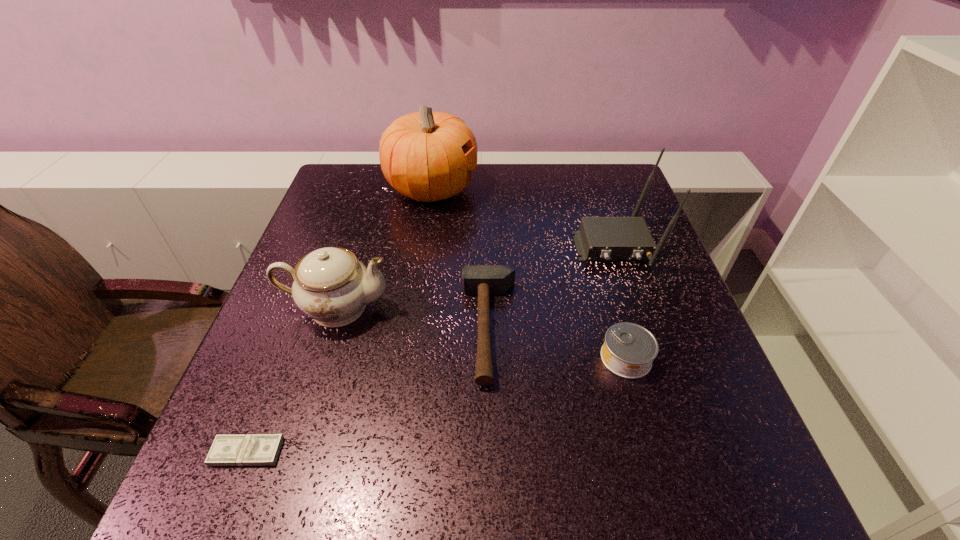
I want to click on can situated at the right edge, so click(x=629, y=349).

You are a GUI agent. You are given a task and a screenshot of the screen. Output one action in this format:
    pyautogui.click(x=<x>, y=<y>)
    Task: Click on the object that is at the near left corner
    
    Given the screenshot: What is the action you would take?
    pyautogui.click(x=250, y=449)

Where is `vacant space at the near edge of the desktop`? The height and width of the screenshot is (540, 960). vacant space at the near edge of the desktop is located at coordinates (354, 475).

The image size is (960, 540). What are the coordinates of `vacant space at the left edge of the desktop` in the screenshot? It's located at (354, 221).

Image resolution: width=960 pixels, height=540 pixels. In the image, there is a desktop. Find the location of `vacant space at the right edge`. vacant space at the right edge is located at coordinates (689, 417).

You are a GUI agent. You are given a task and a screenshot of the screen. Output one action in this format:
    pyautogui.click(x=<x>, y=<y>)
    Task: Click on the vacant space at the far left corner
    
    Given the screenshot: What is the action you would take?
    pyautogui.click(x=332, y=174)

In order to click on vacant space at the far right corner in this screenshot , I will do `click(626, 202)`.

I want to click on vacant space that's between the nearest object and the can, so click(437, 405).

Where is `free point between the hammer and the shortest object`? This screenshot has width=960, height=540. free point between the hammer and the shortest object is located at coordinates (368, 390).

I want to click on free space that is in between the hammer and the shortest object, so pyautogui.click(x=368, y=390).